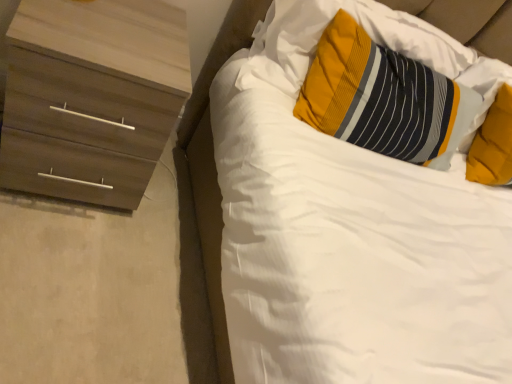
Question: Considering the relative sizes of striped fabric pillow at upper right, which appears as the 1th pillow when viewed from the left, and white soft bed at upper right in the image provided, is striped fabric pillow at upper right, which appears as the 1th pillow when viewed from the left, smaller than white soft bed at upper right?

Choices:
 (A) yes
 (B) no

Answer: (A)

Question: Does striped fabric pillow at upper right, which appears as the 1th pillow when viewed from the left, have a larger size compared to white soft bed at upper right?

Choices:
 (A) yes
 (B) no

Answer: (B)

Question: Is striped fabric pillow at upper right, the second pillow when ordered from right to left, positioned with its back to white soft bed at upper right?

Choices:
 (A) no
 (B) yes

Answer: (B)

Question: Considering the relative sizes of striped fabric pillow at upper right, which appears as the 1th pillow when viewed from the left, and white soft bed at upper right in the image provided, is striped fabric pillow at upper right, which appears as the 1th pillow when viewed from the left, shorter than white soft bed at upper right?

Choices:
 (A) no
 (B) yes

Answer: (B)

Question: Is striped fabric pillow at upper right, the second pillow when ordered from right to left, beside white soft bed at upper right?

Choices:
 (A) no
 (B) yes

Answer: (A)

Question: From a real-world perspective, is striped fabric pillow at upper right, the second pillow when ordered from right to left, below white soft bed at upper right?

Choices:
 (A) yes
 (B) no

Answer: (B)

Question: Considering the relative sizes of wooden chest of drawers at left and striped fabric pillow at upper right, which appears as the 1th pillow when viewed from the left, in the image provided, is wooden chest of drawers at left bigger than striped fabric pillow at upper right, which appears as the 1th pillow when viewed from the left,?

Choices:
 (A) no
 (B) yes

Answer: (B)

Question: Is wooden chest of drawers at left taller than striped fabric pillow at upper right, which appears as the 1th pillow when viewed from the left?

Choices:
 (A) yes
 (B) no

Answer: (A)

Question: From a real-world perspective, is wooden chest of drawers at left over striped fabric pillow at upper right, the second pillow when ordered from right to left?

Choices:
 (A) yes
 (B) no

Answer: (B)

Question: Would you consider wooden chest of drawers at left to be distant from striped fabric pillow at upper right, the second pillow when ordered from right to left?

Choices:
 (A) no
 (B) yes

Answer: (A)

Question: Can you confirm if wooden chest of drawers at left is positioned to the left of striped fabric pillow at upper right, which appears as the 1th pillow when viewed from the left?

Choices:
 (A) no
 (B) yes

Answer: (B)

Question: Is wooden chest of drawers at left shorter than striped fabric pillow at upper right, which appears as the 1th pillow when viewed from the left?

Choices:
 (A) yes
 (B) no

Answer: (B)

Question: Considering the relative positions of soft yellow pillow at upper right, which appears as the second pillow when viewed from the left, and striped fabric pillow at upper right, which appears as the 1th pillow when viewed from the left, in the image provided, is soft yellow pillow at upper right, which appears as the second pillow when viewed from the left, to the right of striped fabric pillow at upper right, which appears as the 1th pillow when viewed from the left, from the viewer's perspective?

Choices:
 (A) yes
 (B) no

Answer: (A)